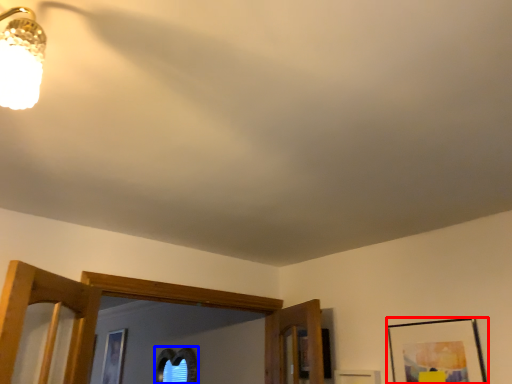
Question: Which object is closer to the camera taking this photo, picture frame (highlighted by a red box) or picture (highlighted by a blue box)?

Choices:
 (A) picture frame
 (B) picture

Answer: (A)